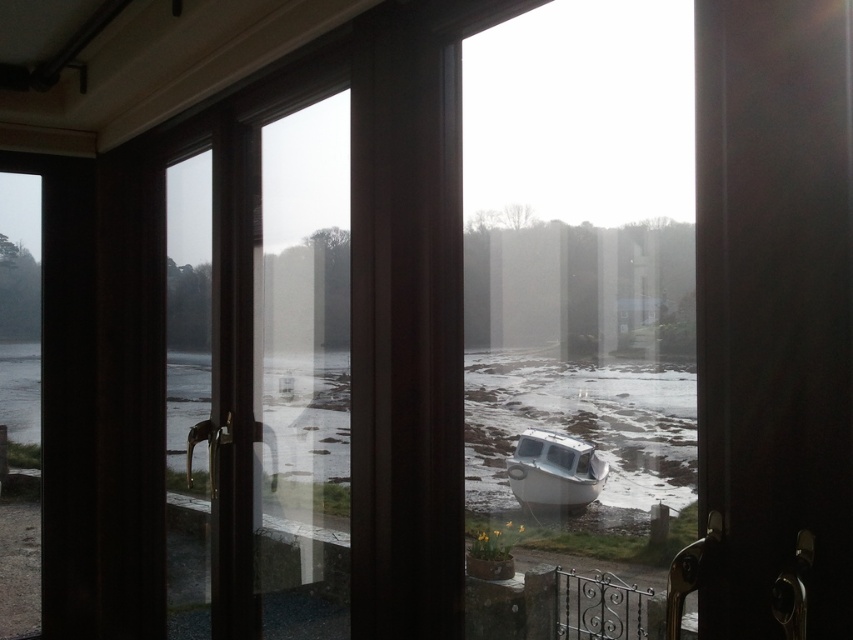
Question: Does dark wood screen door at center appear over white matte boat at center?

Choices:
 (A) no
 (B) yes

Answer: (B)

Question: Considering the real-world distances, which object is closest to the clear water at lower center?

Choices:
 (A) dark wood screen door at center
 (B) white matte boat at center

Answer: (B)

Question: Among these points, which one is farthest from the camera?

Choices:
 (A) (624, 497)
 (B) (584, 483)

Answer: (B)

Question: Is dark wood screen door at center above clear water at lower center?

Choices:
 (A) no
 (B) yes

Answer: (B)

Question: Among these points, which one is farthest from the camera?

Choices:
 (A) (844, 161)
 (B) (555, 492)

Answer: (B)

Question: Is dark wood screen door at center closer to the viewer compared to white matte boat at center?

Choices:
 (A) no
 (B) yes

Answer: (B)